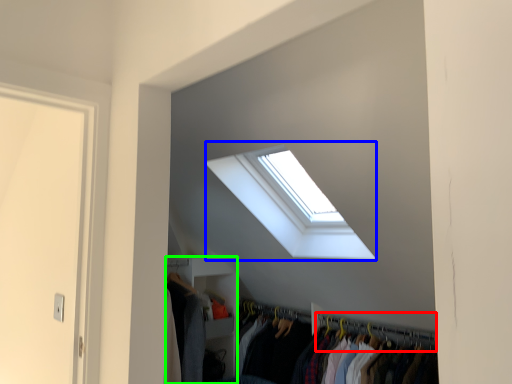
Question: Considering the real-world distances, which object is closest to hanger (highlighted by a red box)? window (highlighted by a blue box) or closet (highlighted by a green box).

Choices:
 (A) window
 (B) closet

Answer: (B)